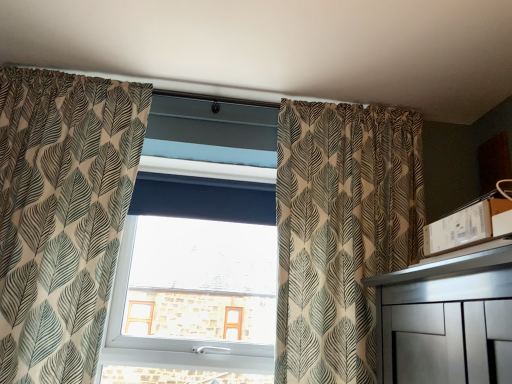
Where is `patterned fabric curtain at left, acting as the 2th curtain starting from the right`? The width and height of the screenshot is (512, 384). patterned fabric curtain at left, acting as the 2th curtain starting from the right is located at coordinates (62, 215).

This screenshot has width=512, height=384. I want to click on transparent glass window at center, so click(x=194, y=276).

What do you see at coordinates (194, 276) in the screenshot? The image size is (512, 384). I see `transparent glass window at center` at bounding box center [194, 276].

Where is `patterned fabric curtain at left, which ranks as the 1th curtain in left-to-right order`? Image resolution: width=512 pixels, height=384 pixels. patterned fabric curtain at left, which ranks as the 1th curtain in left-to-right order is located at coordinates tap(62, 215).

How much distance is there between patterned fabric curtain at left, which ranks as the 1th curtain in left-to-right order, and transparent glass window at center?

patterned fabric curtain at left, which ranks as the 1th curtain in left-to-right order, is 17.19 inches from transparent glass window at center.

In terms of size, does patterned fabric curtain at left, which ranks as the 1th curtain in left-to-right order, appear bigger or smaller than transparent glass window at center?

Considering their sizes, patterned fabric curtain at left, which ranks as the 1th curtain in left-to-right order, takes up more space than transparent glass window at center.

From the picture: From a real-world perspective, which is physically below, patterned fabric curtain at left, acting as the 2th curtain starting from the right, or transparent glass window at center?

transparent glass window at center, from a real-world perspective.

What's the angular difference between patterned fabric curtain at left, acting as the 2th curtain starting from the right, and transparent glass window at center's facing directions?

The facing directions of patterned fabric curtain at left, acting as the 2th curtain starting from the right, and transparent glass window at center are 3.04 degrees apart.

In terms of height, does transparent glass window at center look taller or shorter compared to patterned fabric curtain at left, which ranks as the 1th curtain in left-to-right order?

Clearly, transparent glass window at center is shorter compared to patterned fabric curtain at left, which ranks as the 1th curtain in left-to-right order.

Is transparent glass window at center wider than patterned fabric curtain at left, which ranks as the 1th curtain in left-to-right order?

In fact, transparent glass window at center might be narrower than patterned fabric curtain at left, which ranks as the 1th curtain in left-to-right order.

Which is nearer, (199, 109) or (71, 198)?

Point (199, 109) appears to be farther away from the viewer than point (71, 198).

From the image's perspective, is transparent glass window at center positioned above or below patterned fabric curtain at center, which is the second curtain from left to right?

From the image's perspective, transparent glass window at center appears below patterned fabric curtain at center, which is the second curtain from left to right.

Is transparent glass window at center bigger than patterned fabric curtain at center, acting as the first curtain starting from the right?

Incorrect, transparent glass window at center is not larger than patterned fabric curtain at center, acting as the first curtain starting from the right.

Between point (201, 304) and point (328, 254), which one is positioned in front?

Point (328, 254)

Between transparent glass window at center and patterned fabric curtain at center, acting as the first curtain starting from the right, which one has smaller width?

With smaller width is transparent glass window at center.

Based on the photo, considering the relative positions of patterned fabric curtain at left, acting as the 2th curtain starting from the right, and patterned fabric curtain at center, which is the second curtain from left to right, in the image provided, is patterned fabric curtain at left, acting as the 2th curtain starting from the right, behind patterned fabric curtain at center, which is the second curtain from left to right,?

No, it is in front of patterned fabric curtain at center, which is the second curtain from left to right.

Which is closer to the camera, (103, 198) or (317, 252)?

The point (103, 198) is more forward.

Based on the photo, considering the relative positions of patterned fabric curtain at left, which ranks as the 1th curtain in left-to-right order, and patterned fabric curtain at center, acting as the first curtain starting from the right, in the image provided, is patterned fabric curtain at left, which ranks as the 1th curtain in left-to-right order, to the left or to the right of patterned fabric curtain at center, acting as the first curtain starting from the right,?

patterned fabric curtain at left, which ranks as the 1th curtain in left-to-right order, is positioned on patterned fabric curtain at center, acting as the first curtain starting from the right,'s left side.

From the image's perspective, does patterned fabric curtain at left, which ranks as the 1th curtain in left-to-right order, appear higher than patterned fabric curtain at center, acting as the first curtain starting from the right?

Yes, from the image's perspective, patterned fabric curtain at left, which ranks as the 1th curtain in left-to-right order, is above patterned fabric curtain at center, acting as the first curtain starting from the right.

Is patterned fabric curtain at center, which is the second curtain from left to right, bigger than patterned fabric curtain at left, which ranks as the 1th curtain in left-to-right order?

Indeed, patterned fabric curtain at center, which is the second curtain from left to right, has a larger size compared to patterned fabric curtain at left, which ranks as the 1th curtain in left-to-right order.

From the picture: From a real-world perspective, relative to patterned fabric curtain at left, acting as the 2th curtain starting from the right, is patterned fabric curtain at center, which is the second curtain from left to right, vertically above or below?

patterned fabric curtain at center, which is the second curtain from left to right, is situated higher than patterned fabric curtain at left, acting as the 2th curtain starting from the right, in the real world.

Considering the positions of objects patterned fabric curtain at center, acting as the first curtain starting from the right, and patterned fabric curtain at left, which ranks as the 1th curtain in left-to-right order, in the image provided, who is behind, patterned fabric curtain at center, acting as the first curtain starting from the right, or patterned fabric curtain at left, which ranks as the 1th curtain in left-to-right order,?

patterned fabric curtain at center, acting as the first curtain starting from the right.

Is point (351, 362) closer or farther from the camera than point (242, 277)?

Point (351, 362) is closer to the camera than point (242, 277).

Are patterned fabric curtain at center, acting as the first curtain starting from the right, and transparent glass window at center far apart?

That's not correct — patterned fabric curtain at center, acting as the first curtain starting from the right, is a little close to transparent glass window at center.

Which of these two, patterned fabric curtain at center, which is the second curtain from left to right, or transparent glass window at center, is wider?

With larger width is patterned fabric curtain at center, which is the second curtain from left to right.

Considering the relative positions of patterned fabric curtain at center, which is the second curtain from left to right, and transparent glass window at center in the image provided, is patterned fabric curtain at center, which is the second curtain from left to right, to the right of transparent glass window at center from the viewer's perspective?

Indeed, patterned fabric curtain at center, which is the second curtain from left to right, is positioned on the right side of transparent glass window at center.

Find the location of a particular element. The width and height of the screenshot is (512, 384). window below the patterned fabric curtain at left, which ranks as the 1th curtain in left-to-right order (from a real-world perspective) is located at coordinates (194, 276).

You are a GUI agent. You are given a task and a screenshot of the screen. Output one action in this format:
    pyautogui.click(x=<x>, y=<y>)
    Task: Click on the window below the patterned fabric curtain at left, acting as the 2th curtain starting from the right (from the image's perspective)
    This screenshot has width=512, height=384.
    Given the screenshot: What is the action you would take?
    pyautogui.click(x=194, y=276)

Looking at the image, which one is located closer to patterned fabric curtain at center, acting as the first curtain starting from the right, transparent glass window at center or patterned fabric curtain at left, acting as the 2th curtain starting from the right?

The object closer to patterned fabric curtain at center, acting as the first curtain starting from the right, is transparent glass window at center.

Looking at the image, which one is located closer to transparent glass window at center, patterned fabric curtain at left, acting as the 2th curtain starting from the right, or patterned fabric curtain at center, acting as the first curtain starting from the right?

patterned fabric curtain at left, acting as the 2th curtain starting from the right, is positioned closer to the anchor transparent glass window at center.

Which object lies further to the anchor point patterned fabric curtain at center, which is the second curtain from left to right, patterned fabric curtain at left, acting as the 2th curtain starting from the right, or transparent glass window at center?

Based on the image, patterned fabric curtain at left, acting as the 2th curtain starting from the right, appears to be further to patterned fabric curtain at center, which is the second curtain from left to right.

From the image, which object appears to be farther from patterned fabric curtain at left, which ranks as the 1th curtain in left-to-right order, transparent glass window at center or patterned fabric curtain at center, which is the second curtain from left to right?

patterned fabric curtain at center, which is the second curtain from left to right, is positioned further to the anchor patterned fabric curtain at left, which ranks as the 1th curtain in left-to-right order.

Based on their spatial positions, is patterned fabric curtain at center, acting as the first curtain starting from the right, or transparent glass window at center further from patterned fabric curtain at left, acting as the 2th curtain starting from the right?

patterned fabric curtain at center, acting as the first curtain starting from the right, is positioned further to the anchor patterned fabric curtain at left, acting as the 2th curtain starting from the right.

From the image, which object appears to be nearer to transparent glass window at center, patterned fabric curtain at center, acting as the first curtain starting from the right, or patterned fabric curtain at left, acting as the 2th curtain starting from the right?

The object closer to transparent glass window at center is patterned fabric curtain at left, acting as the 2th curtain starting from the right.

The width and height of the screenshot is (512, 384). I want to click on window between patterned fabric curtain at left, acting as the 2th curtain starting from the right, and patterned fabric curtain at center, acting as the first curtain starting from the right, in the horizontal direction, so click(194, 276).